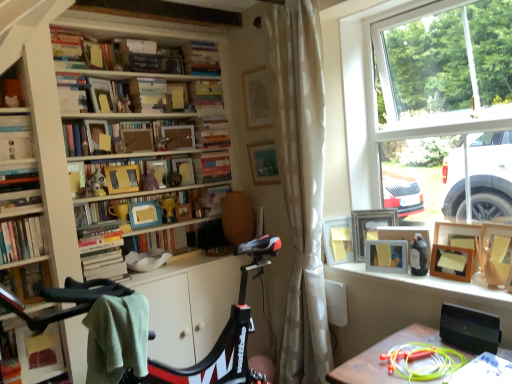
I want to click on wooden picture frame at window, which is counted as the 2th picture frame, starting from the right, so click(452, 263).

What do you see at coordinates (28, 281) in the screenshot?
I see `hardcover book at center, which ranks as the first book in bottom-to-top order` at bounding box center [28, 281].

Measure the distance between wooden frame at upper center, which ranks as the 10th book in bottom-to-top order, and camera.

The depth of wooden frame at upper center, which ranks as the 10th book in bottom-to-top order, is 8.02 feet.

What is the approximate height of wooden frame at upper center, the fourth book when ordered from top to bottom?

wooden frame at upper center, the fourth book when ordered from top to bottom, is 9.22 inches in height.

This screenshot has height=384, width=512. What do you see at coordinates (201, 58) in the screenshot?
I see `hardcover book at upper center, which ranks as the 13th book in bottom-to-top order` at bounding box center [201, 58].

Measure the distance between hardcover book at upper center, marked as the first book in a top-to-bottom arrangement, and camera.

hardcover book at upper center, marked as the first book in a top-to-bottom arrangement, is 2.95 meters from camera.

Describe the element at coordinates (102, 250) in the screenshot. I see `hardcover books at center-left, the 2th book in the bottom-to-top sequence` at that location.

Locate an element on the screen. This screenshot has height=384, width=512. matte yellow picture frame at window, the 3th picture frame viewed from the left is located at coordinates (387, 256).

Who is taller, matte black frame at upper left or wooden frame at upper center, which ranks as the 10th book in bottom-to-top order?

wooden frame at upper center, which ranks as the 10th book in bottom-to-top order, is taller.

Can you confirm if matte black frame at upper left is thinner than wooden frame at upper center, which ranks as the 10th book in bottom-to-top order?

Yes, matte black frame at upper left is thinner than wooden frame at upper center, which ranks as the 10th book in bottom-to-top order.

From the image's perspective, between matte black frame at upper left and wooden frame at upper center, which ranks as the 10th book in bottom-to-top order, which one is located above?

matte black frame at upper left.

Could you tell me if matte black frame at upper left is facing wooden frame at upper center, which ranks as the 10th book in bottom-to-top order?

No, matte black frame at upper left is not oriented towards wooden frame at upper center, which ranks as the 10th book in bottom-to-top order.

Is point (188, 67) farther from camera compared to point (106, 276)?

Yes, point (188, 67) is behind point (106, 276).

Between hardcover book at upper center, which ranks as the 13th book in bottom-to-top order, and hardcover books at center-left, the 2th book in the bottom-to-top sequence, which one appears on the left side from the viewer's perspective?

From the viewer's perspective, hardcover books at center-left, the 2th book in the bottom-to-top sequence, appears more on the left side.

Consider the image. Which of these two, hardcover book at upper center, marked as the first book in a top-to-bottom arrangement, or hardcover books at center-left, the 2th book in the bottom-to-top sequence, is thinner?

hardcover books at center-left, the 2th book in the bottom-to-top sequence.

Can you tell me how much hardcover book at upper center, which ranks as the 13th book in bottom-to-top order, and hardcover books at center-left, which is the twelfth book from top to bottom, differ in facing direction?

0.333 degrees separate the facing orientations of hardcover book at upper center, which ranks as the 13th book in bottom-to-top order, and hardcover books at center-left, which is the twelfth book from top to bottom.

From a real-world perspective, who is located lower, wooden bookcase at left or hardcover book at center, the eleventh book viewed from the top?

hardcover book at center, the eleventh book viewed from the top.

Is wooden bookcase at left positioned beyond the bounds of hardcover book at center, acting as the third book starting from the bottom?

wooden bookcase at left lies outside hardcover book at center, acting as the third book starting from the bottom,'s area.

Could you tell me if wooden bookcase at left is turned towards hardcover book at center, the eleventh book viewed from the top?

Yes, wooden bookcase at left faces towards hardcover book at center, the eleventh book viewed from the top.

Is white dotted fabric curtain at center positioned beyond the bounds of wooden frame at center, the 7th book in the bottom-to-top sequence?

Absolutely, white dotted fabric curtain at center is external to wooden frame at center, the 7th book in the bottom-to-top sequence.

Does white dotted fabric curtain at center have a lesser height compared to wooden frame at center, placed as the seventh book when sorted from top to bottom?

No.

Is the surface of white dotted fabric curtain at center in direct contact with wooden frame at center, the 7th book in the bottom-to-top sequence?

No, white dotted fabric curtain at center is not next to wooden frame at center, the 7th book in the bottom-to-top sequence.

How much distance is there between white dotted fabric curtain at center and wooden frame at center, placed as the seventh book when sorted from top to bottom?

white dotted fabric curtain at center is 1.03 meters from wooden frame at center, placed as the seventh book when sorted from top to bottom.

In order to click on the 5th book behind the matte wooden picture frame at upper center, which is the sixth picture frame in right-to-left order, counting from the anchor's position in this screenshot , I will do pos(213,167).

Is matte wooden picture frame at upper center, positioned as the first picture frame in left-to-right order, taller than hardcover book at center, the 6th book from the top?

Indeed, matte wooden picture frame at upper center, positioned as the first picture frame in left-to-right order, has a greater height compared to hardcover book at center, the 6th book from the top.

Can you confirm if matte wooden picture frame at upper center, positioned as the first picture frame in left-to-right order, is thinner than hardcover book at center, the eighth book ordered from the bottom?

Yes.

Can you confirm if wooden frame at upper center, acting as the eleventh book starting from the bottom, is shorter than hardcover book at left, the 10th book positioned from the top?

No.

Is wooden frame at upper center, which is the third book in top-to-bottom order, with hardcover book at left, positioned as the fourth book in bottom-to-top order?

wooden frame at upper center, which is the third book in top-to-bottom order, and hardcover book at left, positioned as the fourth book in bottom-to-top order, are not in contact.

This screenshot has height=384, width=512. Find the location of `the 5th book directly beneath the wooden frame at upper center, acting as the eleventh book starting from the bottom (from a real-world perspective)`. the 5th book directly beneath the wooden frame at upper center, acting as the eleventh book starting from the bottom (from a real-world perspective) is located at coordinates (21, 239).

Which is correct: wooden frame at upper center, acting as the eleventh book starting from the bottom, is inside hardcover book at left, positioned as the fourth book in bottom-to-top order, or outside of it?

wooden frame at upper center, acting as the eleventh book starting from the bottom, is not inside hardcover book at left, positioned as the fourth book in bottom-to-top order, it's outside.

Looking at this image, can you see wooden bookcase at left touching green fabric desk at lower right?

No, wooden bookcase at left is not in contact with green fabric desk at lower right.

Is wooden bookcase at left positioned beyond the bounds of green fabric desk at lower right?

Yes, wooden bookcase at left is outside of green fabric desk at lower right.

Can you tell me how much wooden bookcase at left and green fabric desk at lower right differ in facing direction?

They differ by 90.1 degrees in their facing directions.

Where is `shelf in front of the wooden frame at upper center, which ranks as the 10th book in bottom-to-top order`? Image resolution: width=512 pixels, height=384 pixels. shelf in front of the wooden frame at upper center, which ranks as the 10th book in bottom-to-top order is located at coordinates (12, 88).

Which book is the 5th one when counting from the left side of the hardcover book at upper center, marked as the first book in a top-to-bottom arrangement? Please provide its 2D coordinates.

[(102, 250)]

From the image, which object appears to be nearer to matte plastic toy at center, the 2th toy in the back-to-front sequence, white dotted fabric curtain at center or matte black frame at upper left?

matte black frame at upper left is positioned closer to the anchor matte plastic toy at center, the 2th toy in the back-to-front sequence.

Considering their positions, is matte wooden frame at center, which appears as the 9th book when viewed from the top, positioned further to wooden frame at center, the 7th book in the bottom-to-top sequence, than hardcover book at center, arranged as the 13th book when viewed from the top?

hardcover book at center, arranged as the 13th book when viewed from the top, is positioned further to the anchor wooden frame at center, the 7th book in the bottom-to-top sequence.

From the image, which object appears to be farther from matte black frame at upper left, matte wooden picture frame at upper center, positioned as the first picture frame in left-to-right order, or hardcover book at left, acting as the 8th book starting from the top?

matte wooden picture frame at upper center, positioned as the first picture frame in left-to-right order, is positioned further to the anchor matte black frame at upper left.

In the scene shown: From the image, which object appears to be nearer to matte purple figurine at center, positioned as the second toy in left-to-right order, wooden picture frame at window, which is counted as the 2th picture frame, starting from the right, or hardcover book at center, the 2th book positioned from the top?

hardcover book at center, the 2th book positioned from the top.

Looking at the image, which one is located further to white dotted fabric curtain at center, hardcover book at upper left, the fifth book in the top-to-bottom sequence, or green fabric desk at lower right?

hardcover book at upper left, the fifth book in the top-to-bottom sequence, is positioned further to the anchor white dotted fabric curtain at center.

From the image, which object appears to be nearer to hardcover book at center, the eighth book ordered from the bottom, wooden picture frame at upper center, which is counted as the 2th picture frame, starting from the left, or wooden bookcase at left?

The object closer to hardcover book at center, the eighth book ordered from the bottom, is wooden picture frame at upper center, which is counted as the 2th picture frame, starting from the left.

From the image, which object appears to be farther from matte plastic toy at center, which appears as the second toy when ordered from the bottom, wooden frame at upper center, the fourth book when ordered from top to bottom, or wooden picture frame at upper right, which is the first picture frame in right-to-left order?

wooden picture frame at upper right, which is the first picture frame in right-to-left order, is positioned further to the anchor matte plastic toy at center, which appears as the second toy when ordered from the bottom.

Considering their positions, is wooden picture frame at upper center, marked as the 5th picture frame in a right-to-left arrangement, positioned further to matte black bird at upper right, arranged as the 1th toy when ordered from the bottom, than wooden frame at center, placed as the seventh book when sorted from top to bottom?

wooden frame at center, placed as the seventh book when sorted from top to bottom.

Find the location of a particular element. This screenshot has width=512, height=384. window sill located between green fabric desk at lower right and wooden picture frame at upper right, which is the first picture frame in right-to-left order, in the depth direction is located at coordinates (434, 285).

This screenshot has width=512, height=384. In order to click on picture frame between wooden frame at upper center, which ranks as the 10th book in bottom-to-top order, and wooden picture frame at upper center, marked as the 5th picture frame in a right-to-left arrangement in this screenshot , I will do `click(256, 99)`.

Locate an element on the screen. toy between wooden frame at upper center, the fourth book when ordered from top to bottom, and white dotted fabric curtain at center is located at coordinates (149, 177).

Image resolution: width=512 pixels, height=384 pixels. What are the coordinates of `curtain between matte wooden picture frame at upper center, which is the sixth picture frame in right-to-left order, and matte yellow picture frame at window, marked as the 4th picture frame in a right-to-left arrangement, vertically` in the screenshot? It's located at (301, 184).